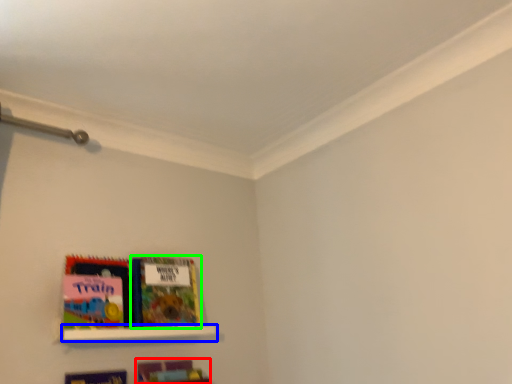
Question: Which object is the closest to the book (highlighted by a red box)? Choose among these: shelf (highlighted by a blue box) or book (highlighted by a green box).

Choices:
 (A) shelf
 (B) book

Answer: (A)